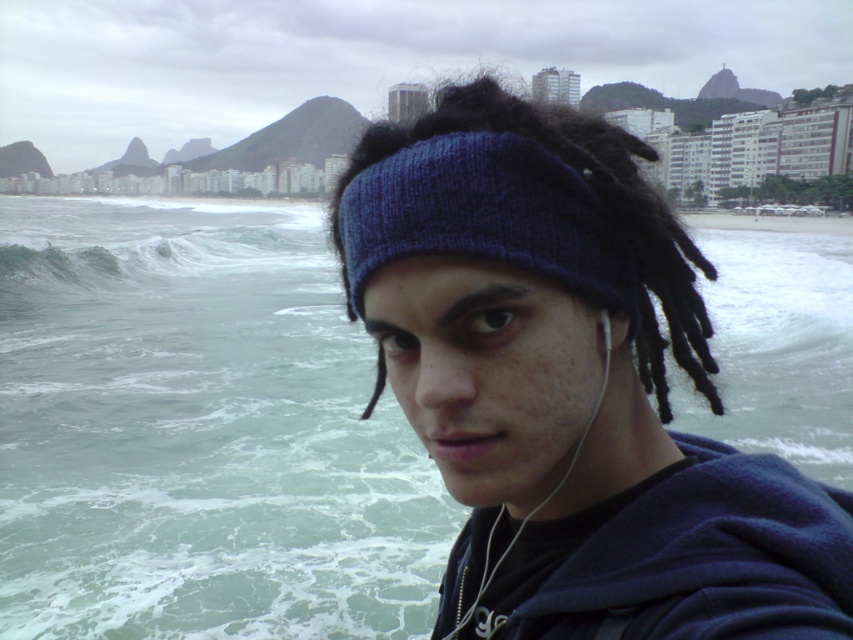
Is greenish water at lower left bigger than green frothy wave at left?

No.

Image resolution: width=853 pixels, height=640 pixels. What are the coordinates of `greenish water at lower left` in the screenshot? It's located at (199, 432).

Where is `greenish water at lower left`? The height and width of the screenshot is (640, 853). greenish water at lower left is located at coordinates (199, 432).